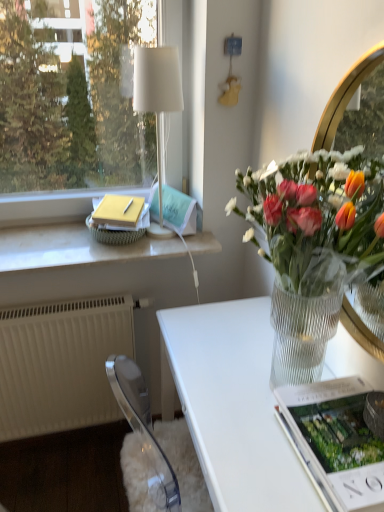
Describe the element at coordinates (60, 364) in the screenshot. The height and width of the screenshot is (512, 384). I see `white plastic radiator at lower left` at that location.

This screenshot has width=384, height=512. Describe the element at coordinates (178, 211) in the screenshot. I see `matte green magazine at upper center, which is the 2th magazine in bottom-to-top order` at that location.

Measure the distance between point (349,414) and camera.

Point (349,414) and camera are 87.40 centimeters apart from each other.

The height and width of the screenshot is (512, 384). What do you see at coordinates (344, 97) in the screenshot? I see `clear gold mirror at upper right` at bounding box center [344, 97].

The width and height of the screenshot is (384, 512). What are the coordinates of `white glossy desk at center` in the screenshot? It's located at (231, 405).

Is white plastic radiator at lower left facing away from white fabric lampshade at upper left?

That's not correct — white plastic radiator at lower left is not looking away from white fabric lampshade at upper left.

Which of these two, white plastic radiator at lower left or white fabric lampshade at upper left, is wider?

white fabric lampshade at upper left is wider.

Where is `radiator below the white fabric lampshade at upper left (from a real-world perspective)`? radiator below the white fabric lampshade at upper left (from a real-world perspective) is located at coordinates (60, 364).

Who is bigger, white marble window sill at upper left or white plastic radiator at lower left?

white plastic radiator at lower left is bigger.

Does point (95, 245) appear closer or farther from the camera than point (98, 374)?

Point (95, 245) is closer to the camera than point (98, 374).

From the image's perspective, is white marble window sill at upper left under white plastic radiator at lower left?

No.

From the image's perspective, is white marble window sill at upper left beneath clear glass vase at right?

Actually, white marble window sill at upper left appears above clear glass vase at right in the image.

Is point (31, 266) closer to camera compared to point (327, 155)?

No, (31, 266) is further to viewer.

Can you confirm if white marble window sill at upper left is positioned to the right of clear glass vase at right?

Incorrect, white marble window sill at upper left is not on the right side of clear glass vase at right.

Is white marble window sill at upper left shorter than clear glass vase at right?

Yes.

Are matte green magazine at upper center, which appears as the 2th magazine when viewed from the right, and white glossy desk at center located far from each other?

They are positioned close to each other.

Which object is positioned more to the left, matte green magazine at upper center, the first magazine positioned from the left, or white glossy desk at center?

matte green magazine at upper center, the first magazine positioned from the left.

Can you confirm if matte green magazine at upper center, the first magazine positioned from the left, is bigger than white glossy desk at center?

Actually, matte green magazine at upper center, the first magazine positioned from the left, might be smaller than white glossy desk at center.

Considering the sizes of white plastic radiator at lower left and matte green magazine at upper center, which is the 2th magazine in bottom-to-top order, in the image, is white plastic radiator at lower left wider or thinner than matte green magazine at upper center, which is the 2th magazine in bottom-to-top order,?

Considering their sizes, white plastic radiator at lower left looks broader than matte green magazine at upper center, which is the 2th magazine in bottom-to-top order.

From the image's perspective, which one is positioned lower, white plastic radiator at lower left or matte green magazine at upper center, the first magazine positioned from the left?

white plastic radiator at lower left is shown below in the image.

Who is shorter, white plastic radiator at lower left or matte green magazine at upper center, the first magazine positioned from the back?

Standing shorter between the two is matte green magazine at upper center, the first magazine positioned from the back.

Is white plastic radiator at lower left in front of or behind matte green magazine at upper center, which is the 2th magazine in front-to-back order, in the image?

white plastic radiator at lower left is in front of matte green magazine at upper center, which is the 2th magazine in front-to-back order.

Which is less distant, [227,415] or [343,508]?

Point [227,415].

Is white glossy desk at center far away from matte white magazine at lower right, which is the first magazine in bottom-to-top order?

They are positioned close to each other.

Do you think white glossy desk at center is within matte white magazine at lower right, which is the second magazine in left-to-right order, or outside of it?

white glossy desk at center is spatially situated outside matte white magazine at lower right, which is the second magazine in left-to-right order.

Is white fabric lampshade at upper left at the right side of white plastic radiator at lower left?

Indeed, white fabric lampshade at upper left is positioned on the right side of white plastic radiator at lower left.

Is white fabric lampshade at upper left oriented away from white plastic radiator at lower left?

No, white plastic radiator at lower left is not at the back of white fabric lampshade at upper left.

From a real-world perspective, which object stands above the other?

white fabric lampshade at upper left.

What are the coordinates of `lamp above the white plastic radiator at lower left (from the image's perspective)` in the screenshot? It's located at (157, 100).

Locate an element on the screen. This screenshot has height=512, width=384. window sill that is in front of the white plastic radiator at lower left is located at coordinates (73, 248).

Considering their positions, is matte white magazine at lower right, which is the 1th magazine in front-to-back order, positioned further to white plastic radiator at lower left than white glossy desk at center?

Based on the image, matte white magazine at lower right, which is the 1th magazine in front-to-back order, appears to be further to white plastic radiator at lower left.

When comparing their distances from clear glass vase at right, does white fabric lampshade at upper left or white plastic radiator at lower left seem further?

white plastic radiator at lower left is further to clear glass vase at right.

Based on the photo, from the image, which object appears to be nearer to white marble window sill at upper left, white glossy desk at center or white fabric lampshade at upper left?

white fabric lampshade at upper left.

When comparing their distances from matte white magazine at lower right, the first magazine from the right, does white marble window sill at upper left or clear gold mirror at upper right seem closer?

The object closer to matte white magazine at lower right, the first magazine from the right, is clear gold mirror at upper right.

Based on their spatial positions, is white glossy desk at center or white plastic radiator at lower left further from matte white magazine at lower right, the first magazine from the right?

white plastic radiator at lower left is further to matte white magazine at lower right, the first magazine from the right.

When comparing their distances from white marble window sill at upper left, does matte green magazine at upper center, which is the 2th magazine in front-to-back order, or matte white magazine at lower right, which is the second magazine in left-to-right order, seem closer?

Among the two, matte green magazine at upper center, which is the 2th magazine in front-to-back order, is located nearer to white marble window sill at upper left.

Considering their positions, is white marble window sill at upper left positioned closer to clear gold mirror at upper right than white glossy desk at center?

Among the two, white glossy desk at center is located nearer to clear gold mirror at upper right.

From the image, which object appears to be nearer to white fabric lampshade at upper left, matte white magazine at lower right, the 2th magazine in the top-to-bottom sequence, or white plastic radiator at lower left?

Based on the image, white plastic radiator at lower left appears to be nearer to white fabric lampshade at upper left.

The height and width of the screenshot is (512, 384). Identify the location of window sill between white fabric lampshade at upper left and white plastic radiator at lower left in the up-down direction. (73, 248).

Find the location of a particular element. The height and width of the screenshot is (512, 384). mirror between white fabric lampshade at upper left and white glossy desk at center vertically is located at coordinates (344, 97).

You are a GUI agent. You are given a task and a screenshot of the screen. Output one action in this format:
    pyautogui.click(x=<x>, y=<y>)
    Task: Click on the lamp between clear glass vase at right and white marble window sill at upper left from front to back
    
    Given the screenshot: What is the action you would take?
    pyautogui.click(x=157, y=100)

The width and height of the screenshot is (384, 512). I want to click on magazine located between clear gold mirror at upper right and matte green magazine at upper center, the first magazine positioned from the left, in the depth direction, so click(x=337, y=441).